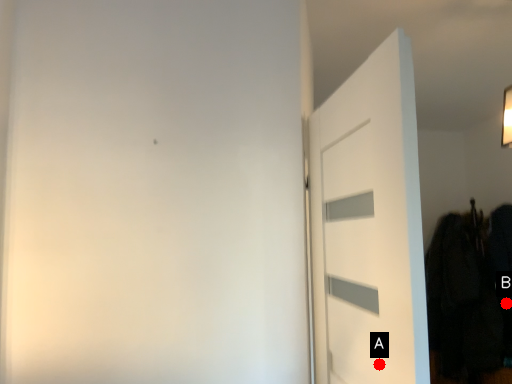
Question: Two points are circled on the image, labeled by A and B beside each circle. Which point appears farthest from the camera in this image?

Choices:
 (A) A is further
 (B) B is further

Answer: (B)